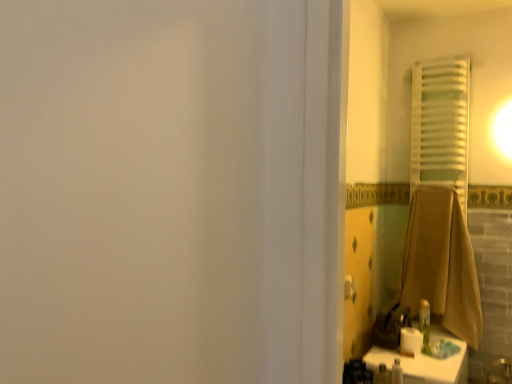
Question: Does white matte toilet paper at lower right have a lesser height compared to white fabric towel at right?

Choices:
 (A) yes
 (B) no

Answer: (A)

Question: From a real-world perspective, is white matte toilet paper at lower right over white fabric towel at right?

Choices:
 (A) no
 (B) yes

Answer: (A)

Question: Can you confirm if white matte toilet paper at lower right is positioned to the right of white fabric towel at right?

Choices:
 (A) yes
 (B) no

Answer: (B)

Question: Is white matte toilet paper at lower right closer to camera compared to white fabric towel at right?

Choices:
 (A) yes
 (B) no

Answer: (A)

Question: Could you tell me if white matte toilet paper at lower right is facing white fabric towel at right?

Choices:
 (A) no
 (B) yes

Answer: (A)

Question: Is white matte toilet paper at lower right located outside white fabric towel at right?

Choices:
 (A) no
 (B) yes

Answer: (B)

Question: Could you tell me if brown cotton towel at right is facing white glossy counter top at lower right?

Choices:
 (A) no
 (B) yes

Answer: (A)

Question: Considering the relative positions of brown cotton towel at right and white glossy counter top at lower right in the image provided, is brown cotton towel at right to the right of white glossy counter top at lower right from the viewer's perspective?

Choices:
 (A) yes
 (B) no

Answer: (A)

Question: Is brown cotton towel at right to the left of white glossy counter top at lower right from the viewer's perspective?

Choices:
 (A) no
 (B) yes

Answer: (A)

Question: Is brown cotton towel at right completely or partially outside of white glossy counter top at lower right?

Choices:
 (A) yes
 (B) no

Answer: (A)

Question: From a real-world perspective, is brown cotton towel at right located beneath white glossy counter top at lower right?

Choices:
 (A) no
 (B) yes

Answer: (A)

Question: From the image's perspective, is brown cotton towel at right located above white glossy counter top at lower right?

Choices:
 (A) yes
 (B) no

Answer: (A)

Question: Is white matte toilet paper at lower right closer to camera compared to brown cotton towel at right?

Choices:
 (A) yes
 (B) no

Answer: (A)